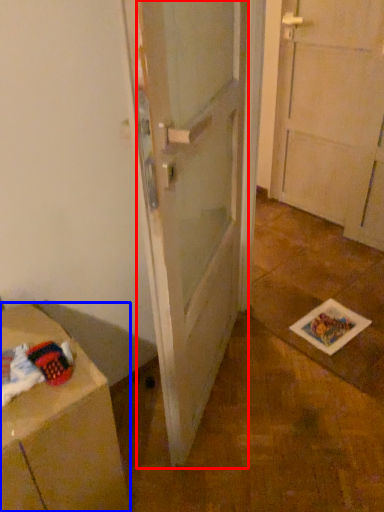
Question: Which object is closer to the camera taking this photo, door (highlighted by a red box) or cabinetry (highlighted by a blue box)?

Choices:
 (A) door
 (B) cabinetry

Answer: (A)